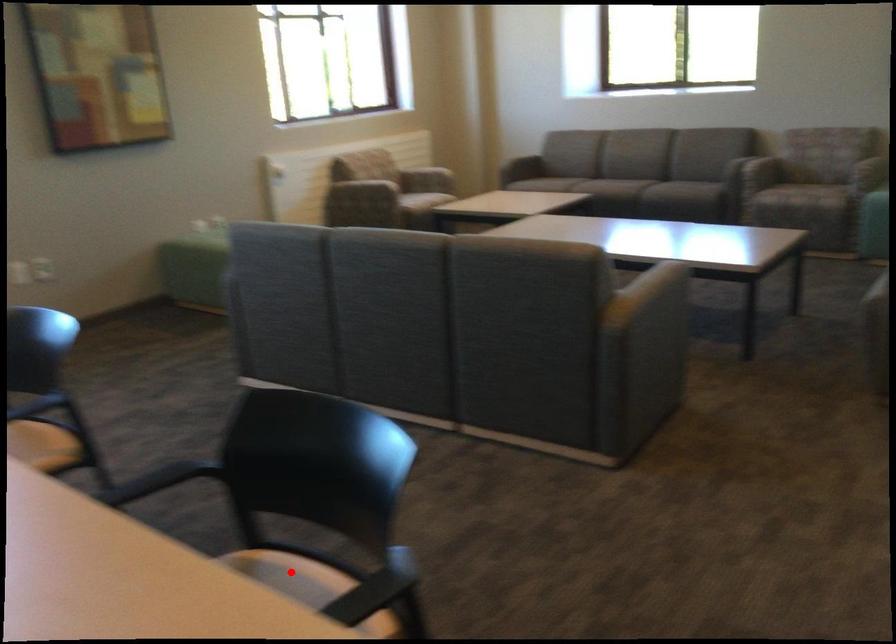
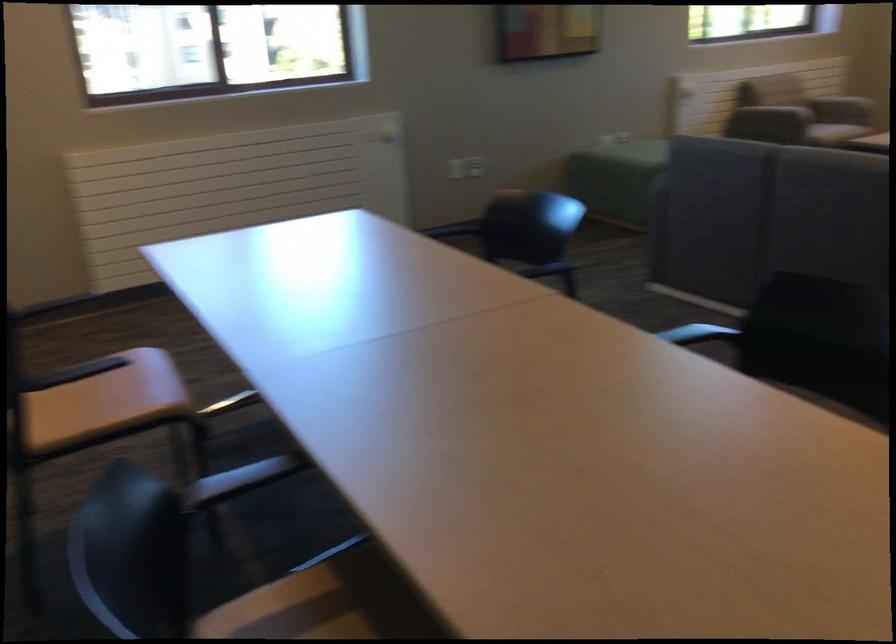
Question: I am providing you with two images of the same scene from different viewpoints. A red point is marked on the first image. At the location where the point appears in image 1, is it still visible in image 2?

Choices:
 (A) Yes
 (B) No

Answer: (B)